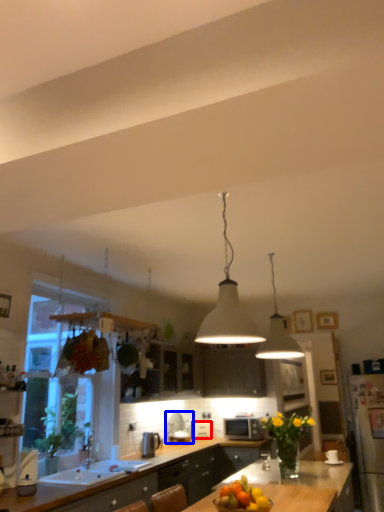
Question: Among these objects, which one is nearest to the camera, appliance (highlighted by a red box) or appliance (highlighted by a blue box)?

Choices:
 (A) appliance
 (B) appliance

Answer: (B)